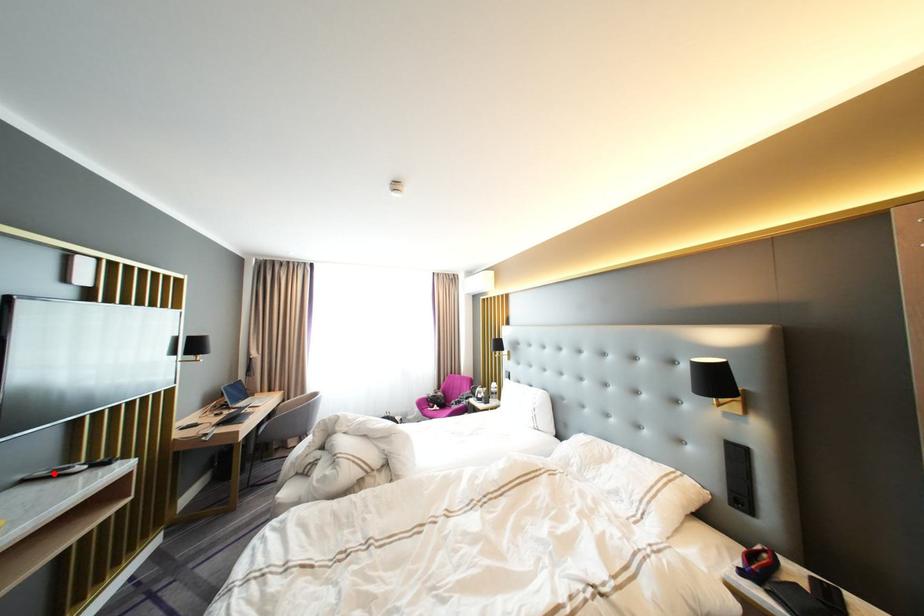
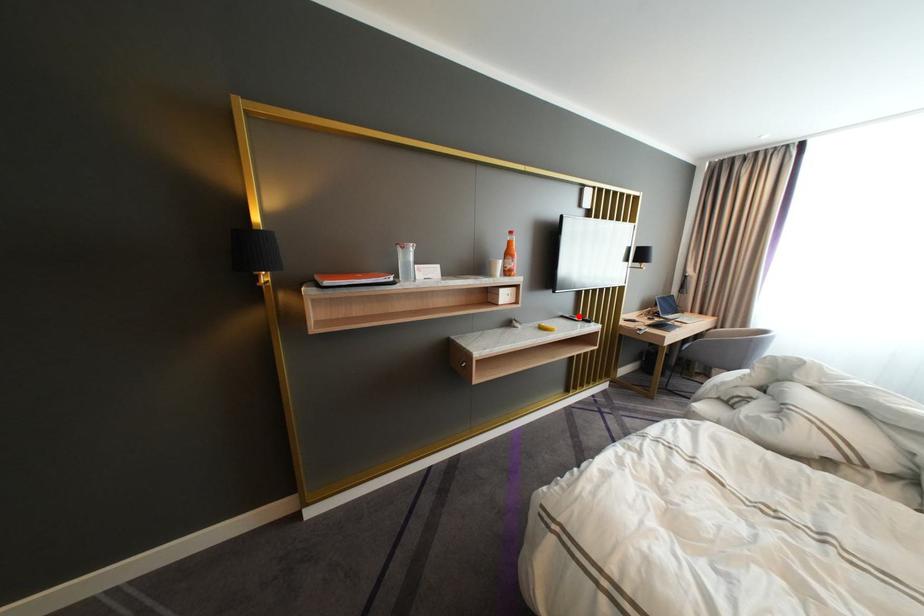
I am providing you with two images of the same scene from different viewpoints. A red point is marked on the first image and another point is marked on the second image. Are the points marked in image1 and image2 representing the same 3D position?

Yes